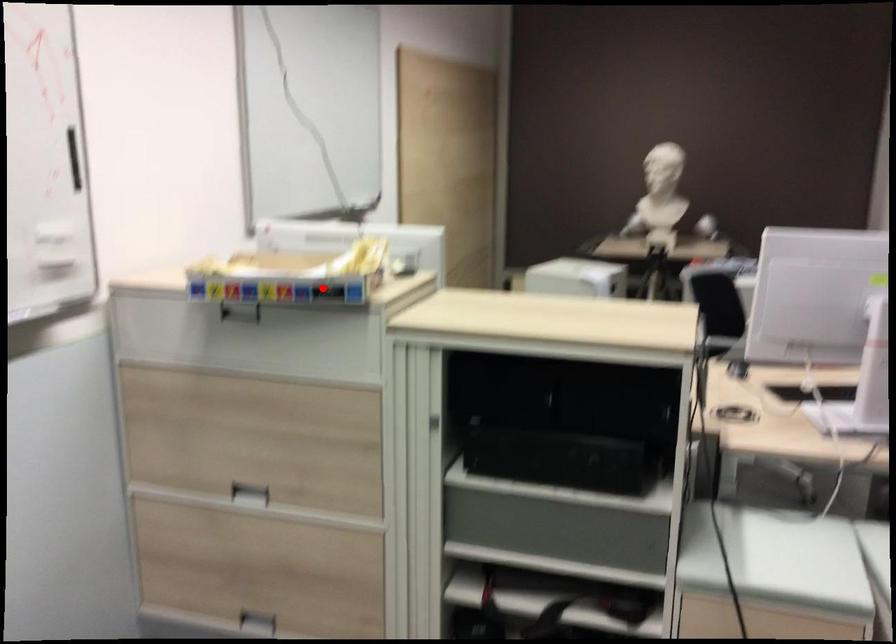
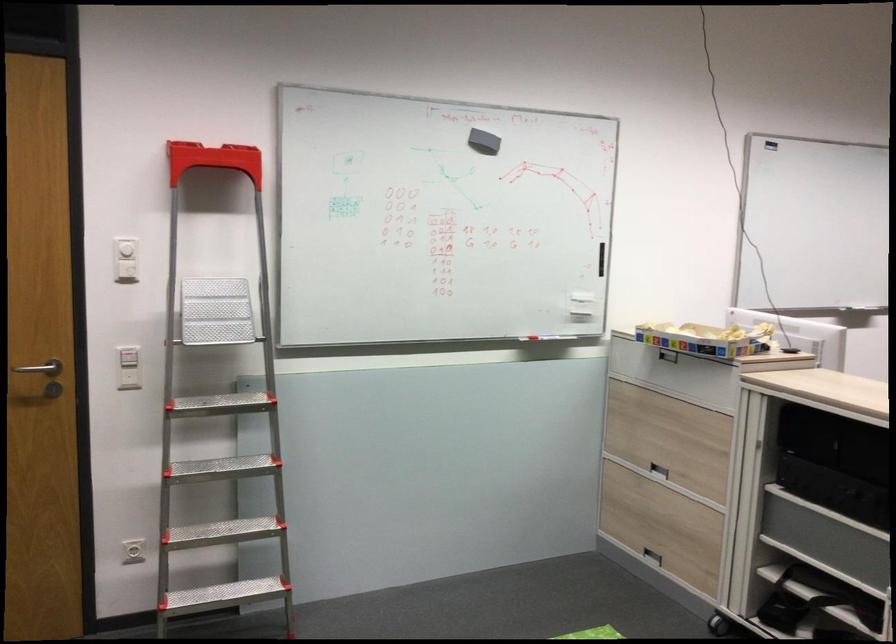
Question: I am providing you with two images of the same scene from different viewpoints. Given a red point in image1, look at the same physical point in image2. Is it:

Choices:
 (A) Closer to the viewpoint
 (B) Farther from the viewpoint

Answer: (B)